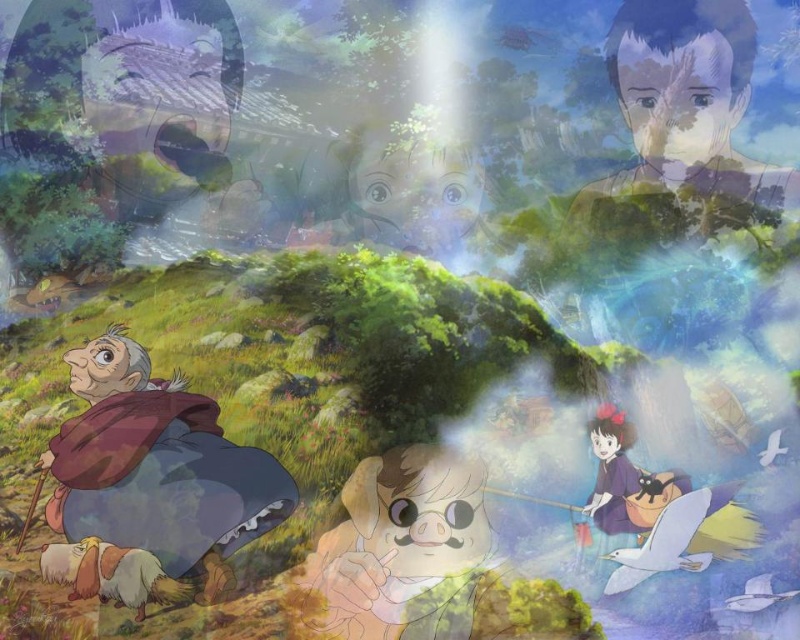
You are an artist trying to paint this scene. You want to ensure that the point at point (x=629, y=61) and the point at point (x=401, y=218) are correctly placed in terms of depth. Which point should you paint first to maintain the proper layering?

Point (x=629, y=61) should be painted first because it is closer to the viewer than point (x=401, y=218), ensuring proper layering by starting with foreground elements.

You are standing at the center of the image and want to move towards the point marked at coordinate point (x=154, y=477). Which direction should you go?

The point (x=154, y=477) is on brown woolen coat at lower left, so you should move towards the lower left direction to reach it.